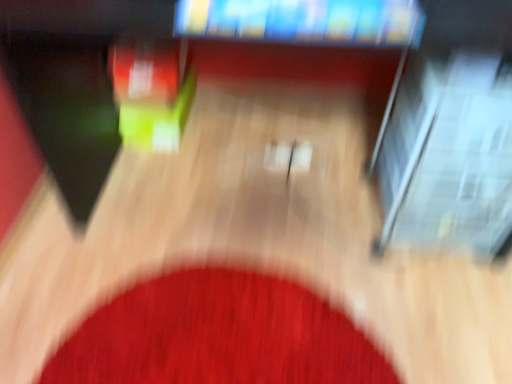
Find the location of a particular element. matte plastic television at upper center is located at coordinates (304, 21).

What do you see at coordinates (304, 21) in the screenshot?
I see `matte plastic television at upper center` at bounding box center [304, 21].

You are a GUI agent. You are given a task and a screenshot of the screen. Output one action in this format:
    pyautogui.click(x=<x>, y=<y>)
    Task: Click on the red carpet at center
    The image size is (512, 384).
    Given the screenshot: What is the action you would take?
    pyautogui.click(x=218, y=335)

Describe the element at coordinates (218, 335) in the screenshot. I see `red carpet at center` at that location.

Locate an element on the screen. Image resolution: width=512 pixels, height=384 pixels. matte plastic television at upper center is located at coordinates (304, 21).

Considering the relative positions of matte plastic television at upper center and red carpet at center in the image provided, is matte plastic television at upper center to the left of red carpet at center from the viewer's perspective?

In fact, matte plastic television at upper center is to the right of red carpet at center.

Which object is closer to the camera, matte plastic television at upper center or red carpet at center?

matte plastic television at upper center is in front.

Does point (320, 23) lie in front of point (199, 360)?

That is True.

From the image's perspective, relative to red carpet at center, is matte plastic television at upper center above or below?

matte plastic television at upper center is above red carpet at center.

From a real-world perspective, between matte plastic television at upper center and red carpet at center, who is vertically lower?

red carpet at center is physically lower.

Looking at their sizes, would you say matte plastic television at upper center is wider or thinner than red carpet at center?

matte plastic television at upper center is thinner than red carpet at center.

Based on the photo, from their relative heights in the image, would you say matte plastic television at upper center is taller or shorter than red carpet at center?

matte plastic television at upper center is shorter than red carpet at center.

Considering the sizes of objects matte plastic television at upper center and red carpet at center in the image provided, who is bigger, matte plastic television at upper center or red carpet at center?

Bigger between the two is red carpet at center.

Would you say matte plastic television at upper center is inside or outside red carpet at center?

The correct answer is: outside.

Is matte plastic television at upper center far away from red carpet at center?

No, matte plastic television at upper center is not far away from red carpet at center.

Is red carpet at center at the back of matte plastic television at upper center?

No, red carpet at center is not at the back of matte plastic television at upper center.

How many degrees apart are the facing directions of matte plastic television at upper center and red carpet at center?

The angle between the facing direction of matte plastic television at upper center and the facing direction of red carpet at center is 2.18 degrees.

Measure the distance from matte plastic television at upper center to red carpet at center.

31.37 inches.

Where is `mat lying on the left of matte plastic television at upper center`? mat lying on the left of matte plastic television at upper center is located at coordinates (218, 335).

Which object is positioned more to the right, red carpet at center or matte plastic television at upper center?

matte plastic television at upper center.

Is red carpet at center positioned behind matte plastic television at upper center?

Yes, it is.

Is point (291, 333) less distant than point (275, 3)?

That is False.

From the image's perspective, is red carpet at center over matte plastic television at upper center?

Actually, red carpet at center appears below matte plastic television at upper center in the image.

From a real-world perspective, who is located higher, red carpet at center or matte plastic television at upper center?

matte plastic television at upper center.

Which of these two, red carpet at center or matte plastic television at upper center, is thinner?

Thinner between the two is matte plastic television at upper center.

Who is shorter, red carpet at center or matte plastic television at upper center?

With less height is matte plastic television at upper center.

Which of these two, red carpet at center or matte plastic television at upper center, is bigger?

red carpet at center.

In the scene shown: Can we say red carpet at center lies outside matte plastic television at upper center?

Yes, red carpet at center is outside of matte plastic television at upper center.

Is red carpet at center far from matte plastic television at upper center?

No, there isn't a large distance between red carpet at center and matte plastic television at upper center.

Is red carpet at center oriented towards matte plastic television at upper center?

No, red carpet at center does not turn towards matte plastic television at upper center.

How many degrees apart are the facing directions of red carpet at center and matte plastic television at upper center?

2.18 degrees.

In the image, there is a red carpet at center. At what (x,y) coordinates should I click in order to perform the action: click on television above it (from the image's perspective). Please return your answer as a coordinate pair (x, y). This screenshot has height=384, width=512. Looking at the image, I should click on point(304,21).

Identify the location of television that is above the red carpet at center (from a real-world perspective). (304, 21).

Find the location of a particular element. This screenshot has width=512, height=384. mat that is behind the matte plastic television at upper center is located at coordinates (218, 335).